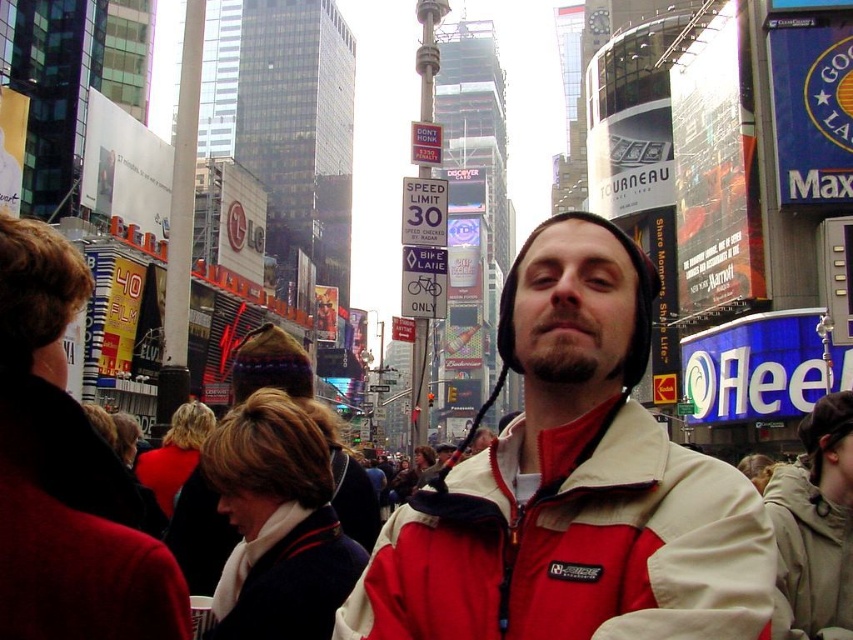
You are a photographer standing in Times Square, New York City. You want to take a photo of both the red and white jacket at center and the light gray fleece jacket at lower right in the same frame. Given that your camera has a maximum focus range of 10 meters, will you be able to capture both jackets in focus without moving?

The red and white jacket at center and the light gray fleece jacket at lower right are 9.37 meters apart. Since the distance between them is within the camera maximum focus range of 10 meters, you can capture both jackets in focus without moving.

You are a photographer trying to capture both the red and white jacket at center and the light gray fleece jacket at lower right in the same frame. Given their sizes in the image, which jacket will appear larger in your photo?

The red and white jacket at center will appear larger in the photo because it is much taller than the light gray fleece jacket at lower right.